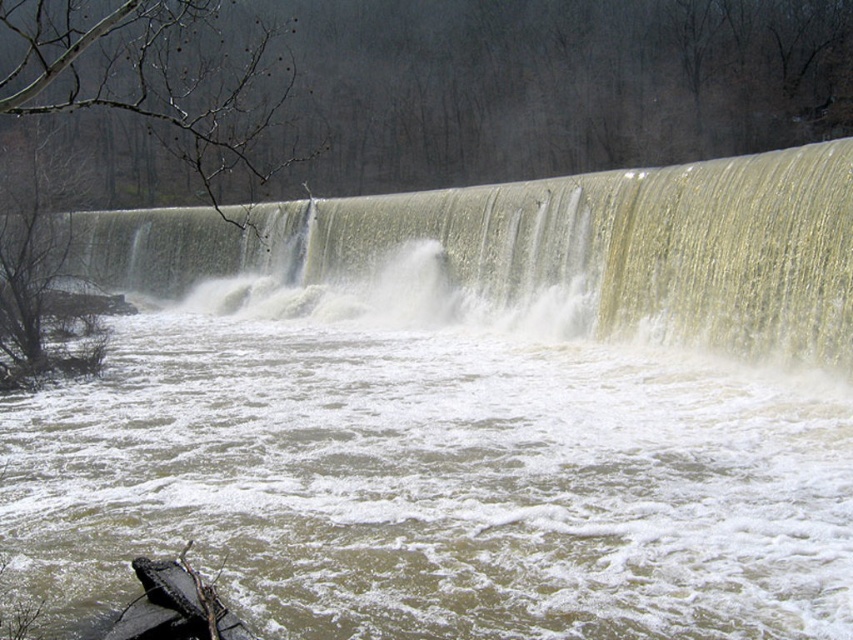
Question: Does brown muddy water at center appear on the right side of greenish-yellow textured waterfall at center?

Choices:
 (A) yes
 (B) no

Answer: (A)

Question: Among these points, which one is nearest to the camera?

Choices:
 (A) (523, 330)
 (B) (821, 188)
 (C) (132, 628)

Answer: (C)

Question: Considering the real-world distances, which object is farthest from the black rubber boat at lower left?

Choices:
 (A) greenish-yellow textured waterfall at center
 (B) brown muddy water at center

Answer: (A)

Question: Observing the image, what is the correct spatial positioning of brown muddy water at center in reference to black rubber boat at lower left?

Choices:
 (A) below
 (B) above

Answer: (B)

Question: Which point is farther to the camera?

Choices:
 (A) brown muddy water at center
 (B) greenish-yellow textured waterfall at center
 (C) black rubber boat at lower left

Answer: (B)

Question: Is brown muddy water at center wider than black rubber boat at lower left?

Choices:
 (A) no
 (B) yes

Answer: (B)